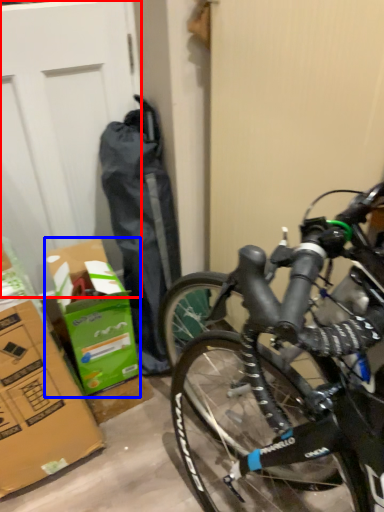
Question: Which point is closer to the camera, garage door (highlighted by a red box) or cardboard box (highlighted by a blue box)?

Choices:
 (A) garage door
 (B) cardboard box

Answer: (A)